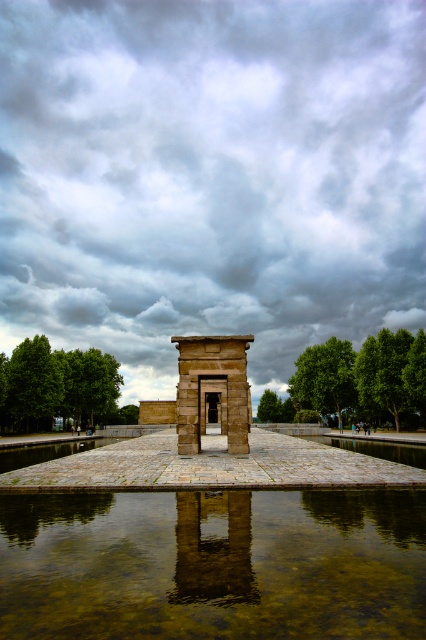
You are standing in front of the ancient stone temple and looking at the reflective pool. There is a point marked at coordinates (210, 177). What object or feature is located at that point?

The point at coordinates (210, 177) corresponds to the cloudy sky at upper center.

You are an architect analyzing the symmetry of the ancient temple. Based on the image, which object between the cloudy sky at upper center and the clear water at center has a larger vertical dimension?

The cloudy sky at upper center has a greater height compared to the clear water at center, so the cloudy sky at upper center has a larger vertical dimension.

Looking at this image, you are an architect analyzing the symmetry of the temple structure. The temple has a central column and two smaller columns flanking it. Where is the cloudy sky at upper center located in the image?

The cloudy sky at upper center is located at the 2D coordinates point [210,177] in the image.